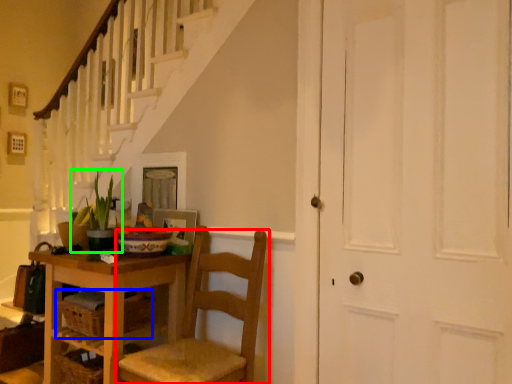
Question: Based on their relative distances, which object is nearer to chair (highlighted by a red box)? Choose from drawer (highlighted by a blue box) and houseplant (highlighted by a green box).

Choices:
 (A) drawer
 (B) houseplant

Answer: (A)